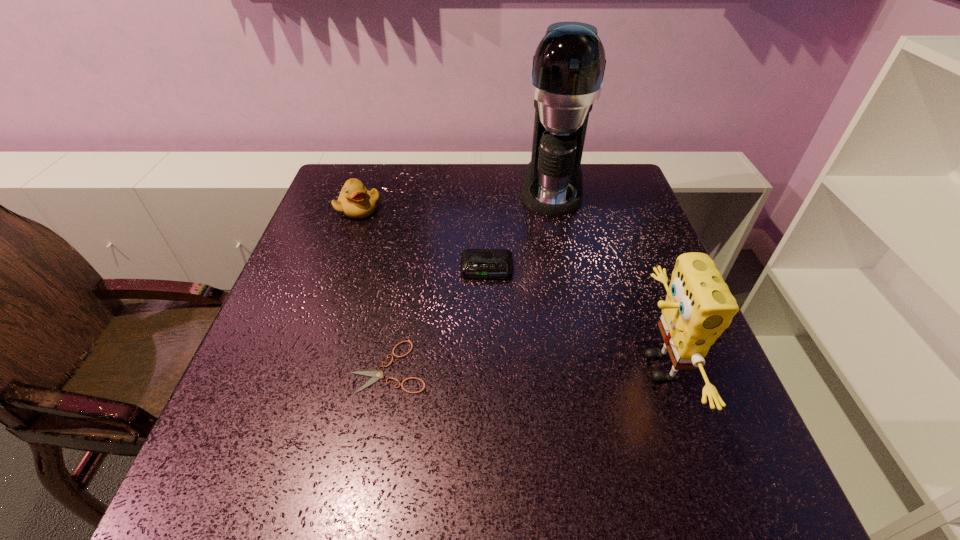
Locate an element on the screen. Image resolution: width=960 pixels, height=540 pixels. free space located place cup under the spout of the coffee maker is located at coordinates point(547,288).

I want to click on duckling present at the far edge, so click(x=355, y=201).

At what (x,y) coordinates should I click in order to perform the action: click on coffee maker positioned at the far edge. Please return your answer as a coordinate pair (x, y). The height and width of the screenshot is (540, 960). Looking at the image, I should click on (568, 68).

Where is `object that is positioned at the near edge`? The height and width of the screenshot is (540, 960). object that is positioned at the near edge is located at coordinates (699, 306).

The width and height of the screenshot is (960, 540). I want to click on object that is at the left edge, so click(x=355, y=201).

Where is `sponge at the right edge`? sponge at the right edge is located at coordinates (699, 306).

Locate an element on the screen. coffee maker that is at the right edge is located at coordinates (568, 68).

What are the coordinates of `object positioned at the far left corner` in the screenshot? It's located at (355, 201).

This screenshot has width=960, height=540. I want to click on object located at the far right corner, so click(x=568, y=68).

Locate an element on the screen. object that is at the near right corner is located at coordinates (x=699, y=306).